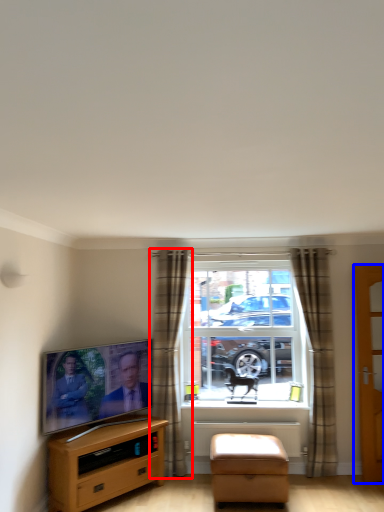
Question: Which of the following is the closest to the observer, curtain (highlighted by a red box) or door (highlighted by a blue box)?

Choices:
 (A) curtain
 (B) door

Answer: (B)